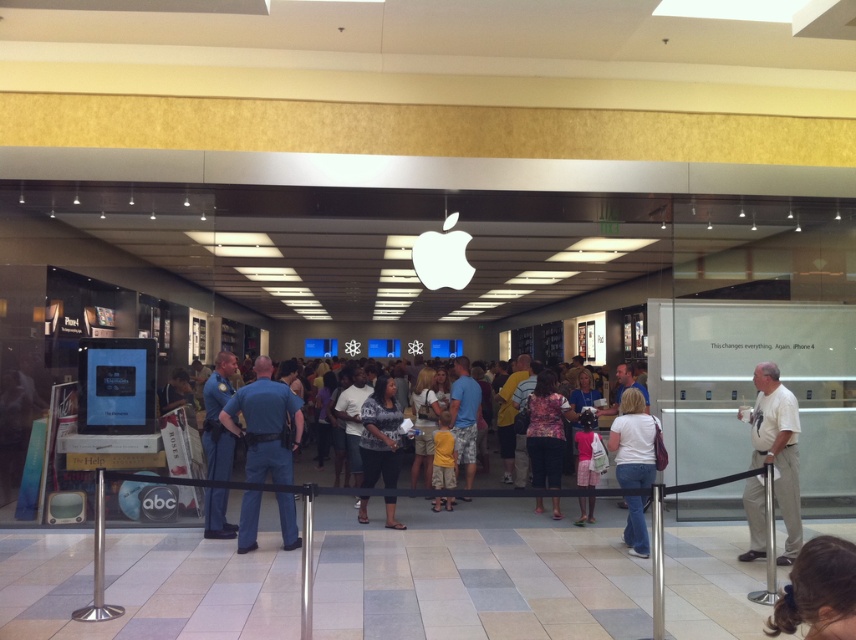
You are a customer waiting to enter the Apple store. You notice two people in the queue. One person is wearing blue jeans at center and another has dark brown hair at lower right. Which person is closer to the entrance?

The blue jeans at center is closer to the entrance because the dark brown hair at lower right is behind them.